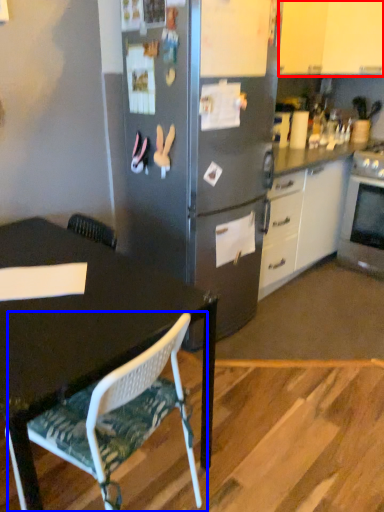
Question: Among these objects, which one is farthest to the camera, cabinetry (highlighted by a red box) or chair (highlighted by a blue box)?

Choices:
 (A) cabinetry
 (B) chair

Answer: (A)